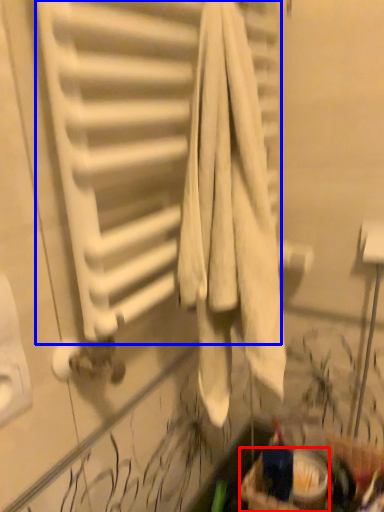
Question: Among these objects, which one is nearest to the camera, basket (highlighted by a red box) or radiator (highlighted by a blue box)?

Choices:
 (A) basket
 (B) radiator

Answer: (B)